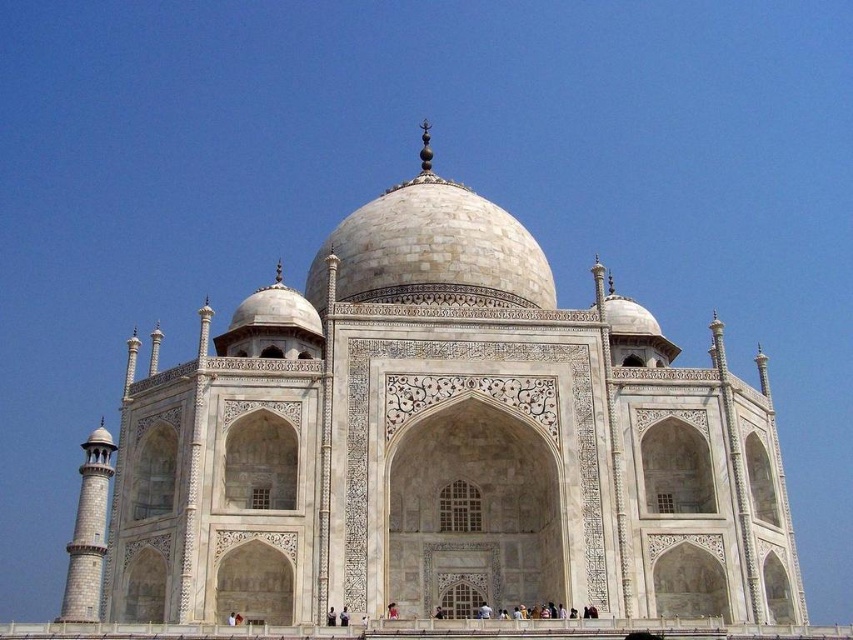
You are standing at the point marked as point (x=268, y=536). The Taj Mahal is in front of you. If you walk straight ahead, will you get closer to the Taj Mahal?

Yes, walking straight ahead from point (x=268, y=536) will bring you closer to the Taj Mahal since you are facing it directly.

You are standing in front of the Taj Mahal and looking at two points marked on the structure. The first point is at coordinates point [753,561] and the second is at point [344,611]. Which of these points is closer to your viewpoint?

Point [753,561] is further to the camera than point [344,611], so the point closer to your viewpoint is point [344,611].